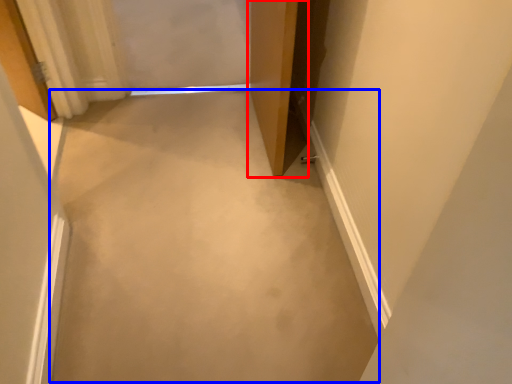
Question: Which object is closer to the camera taking this photo, door (highlighted by a red box) or concrete (highlighted by a blue box)?

Choices:
 (A) door
 (B) concrete

Answer: (B)